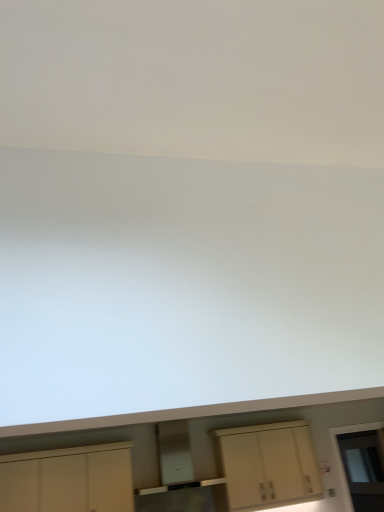
Question: From a real-world perspective, is white matte cabinet at lower left, acting as the second cabinetry starting from the right, located beneath matte cream cabinet at center, the 2th cabinetry positioned from the left?

Choices:
 (A) no
 (B) yes

Answer: (A)

Question: Is white matte cabinet at lower left, which ranks as the 1th cabinetry in left-to-right order, oriented towards matte cream cabinet at center, which is counted as the first cabinetry, starting from the right?

Choices:
 (A) no
 (B) yes

Answer: (A)

Question: Can you confirm if white matte cabinet at lower left, which ranks as the 1th cabinetry in left-to-right order, is wider than matte cream cabinet at center, which is counted as the first cabinetry, starting from the right?

Choices:
 (A) yes
 (B) no

Answer: (A)

Question: Can you confirm if white matte cabinet at lower left, which ranks as the 1th cabinetry in left-to-right order, is smaller than matte cream cabinet at center, which is counted as the first cabinetry, starting from the right?

Choices:
 (A) yes
 (B) no

Answer: (A)

Question: Are white matte cabinet at lower left, acting as the second cabinetry starting from the right, and matte cream cabinet at center, which is counted as the first cabinetry, starting from the right, located far from each other?

Choices:
 (A) no
 (B) yes

Answer: (B)

Question: Looking at the image, does matte cream cabinet at center, which is counted as the first cabinetry, starting from the right, seem bigger or smaller compared to white matte cabinet at lower left, acting as the second cabinetry starting from the right?

Choices:
 (A) big
 (B) small

Answer: (A)

Question: Is matte cream cabinet at center, the 2th cabinetry positioned from the left, wider or thinner than white matte cabinet at lower left, which ranks as the 1th cabinetry in left-to-right order?

Choices:
 (A) thin
 (B) wide

Answer: (A)

Question: In the image, is matte cream cabinet at center, which is counted as the first cabinetry, starting from the right, on the left side or the right side of white matte cabinet at lower left, acting as the second cabinetry starting from the right?

Choices:
 (A) right
 (B) left

Answer: (A)

Question: In the image, is matte cream cabinet at center, the 2th cabinetry positioned from the left, positioned in front of or behind white matte cabinet at lower left, acting as the second cabinetry starting from the right?

Choices:
 (A) behind
 (B) front

Answer: (A)

Question: From a real-world perspective, is matte cream cabinet at center, which is counted as the first cabinetry, starting from the right, positioned above or below transparent glass door at lower right?

Choices:
 (A) above
 (B) below

Answer: (A)

Question: Considering the positions of matte cream cabinet at center, which is counted as the first cabinetry, starting from the right, and transparent glass door at lower right in the image, is matte cream cabinet at center, which is counted as the first cabinetry, starting from the right, taller or shorter than transparent glass door at lower right?

Choices:
 (A) short
 (B) tall

Answer: (A)

Question: From the image's perspective, is matte cream cabinet at center, which is counted as the first cabinetry, starting from the right, positioned above or below transparent glass door at lower right?

Choices:
 (A) above
 (B) below

Answer: (A)

Question: In the image, is matte cream cabinet at center, which is counted as the first cabinetry, starting from the right, positioned in front of or behind transparent glass door at lower right?

Choices:
 (A) front
 (B) behind

Answer: (A)

Question: From the image's perspective, is white matte cabinet at lower left, which ranks as the 1th cabinetry in left-to-right order, positioned above or below matte cream cabinet at center, the 2th cabinetry positioned from the left?

Choices:
 (A) above
 (B) below

Answer: (A)

Question: Relative to matte cream cabinet at center, the 2th cabinetry positioned from the left, is white matte cabinet at lower left, which ranks as the 1th cabinetry in left-to-right order, in front or behind?

Choices:
 (A) behind
 (B) front

Answer: (B)